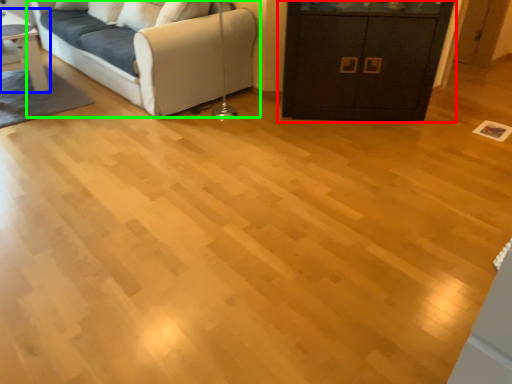
Question: Considering the real-world distances, which object is farthest from cabinetry (highlighted by a red box)? table (highlighted by a blue box) or studio couch (highlighted by a green box)?

Choices:
 (A) table
 (B) studio couch

Answer: (A)